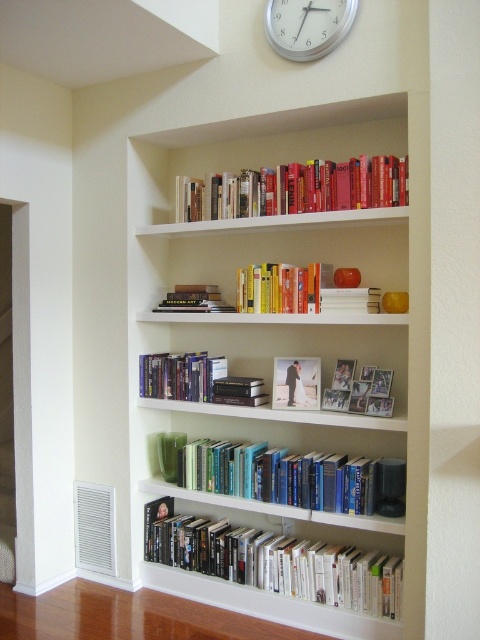
You are an interior designer arranging items on the bookshelf. You need to place a large decorative item that requires more space. Which object between the white matte bookcase at upper center and the blue hardcover books at center should you place it next to, and why?

You should place the large decorative item next to the white matte bookcase at upper center because it is bigger and can accommodate more space compared to the blue hardcover books at center.

You are an interior designer arranging items on a bookshelf. You need to place a new decorative item between the blue hardcover books at center and the hardcover books at upper center. Based on their positions, where should you place the item?

The blue hardcover books at center is positioned under the hardcover books at upper center, so you should place the new decorative item between them in the vertical space between the two sets of books.